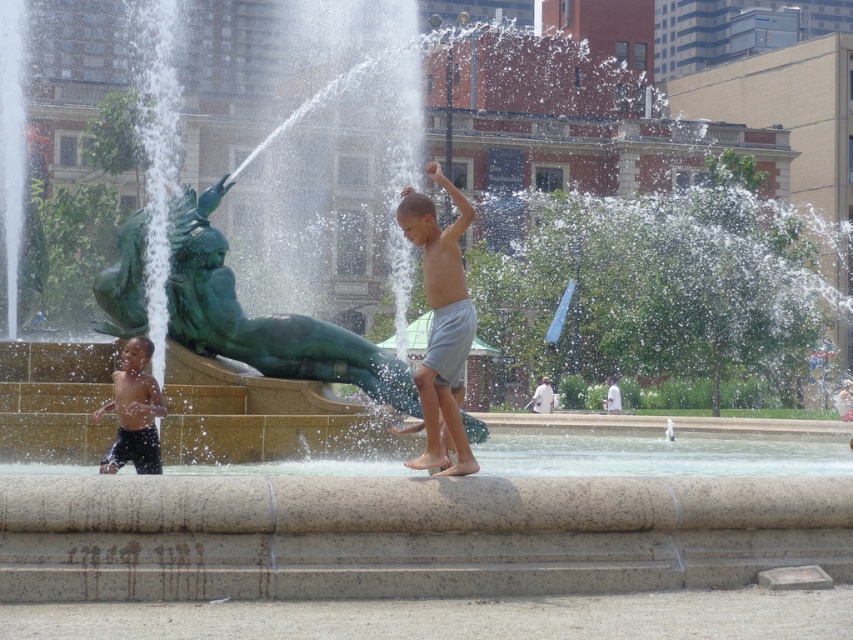
Between gray cotton shorts at center and matte black shorts at lower left, which one has more height?

gray cotton shorts at center is taller.

Can you confirm if gray cotton shorts at center is positioned to the right of matte black shorts at lower left?

Correct, you'll find gray cotton shorts at center to the right of matte black shorts at lower left.

Describe the element at coordinates (440, 323) in the screenshot. I see `gray cotton shorts at center` at that location.

Where is `gray cotton shorts at center`? gray cotton shorts at center is located at coordinates (440, 323).